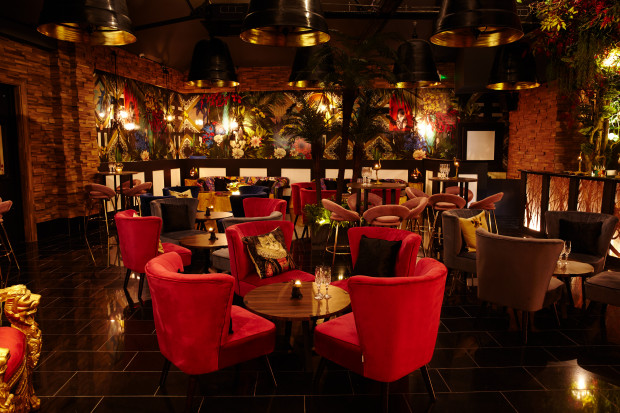
The height and width of the screenshot is (413, 620). I want to click on round table top, so [x=273, y=306].